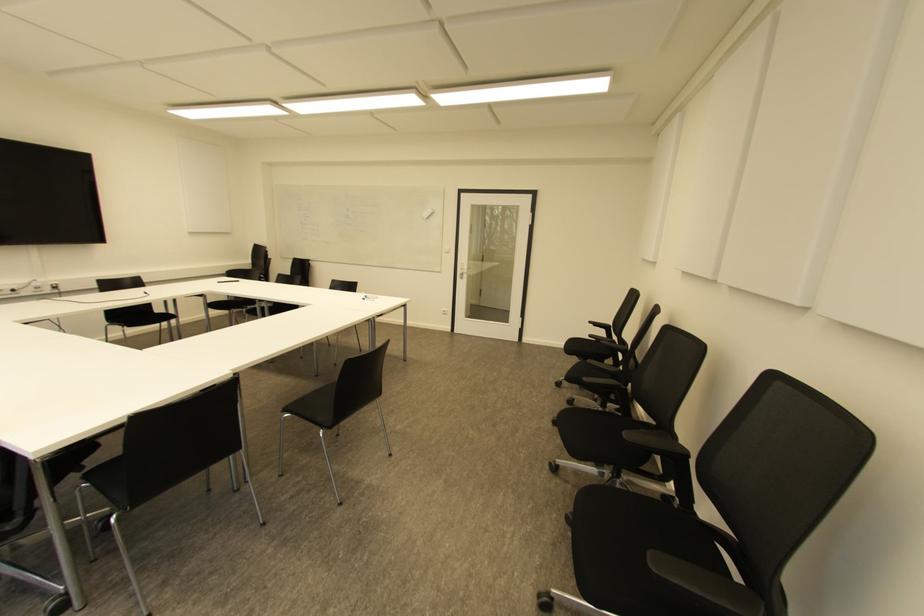
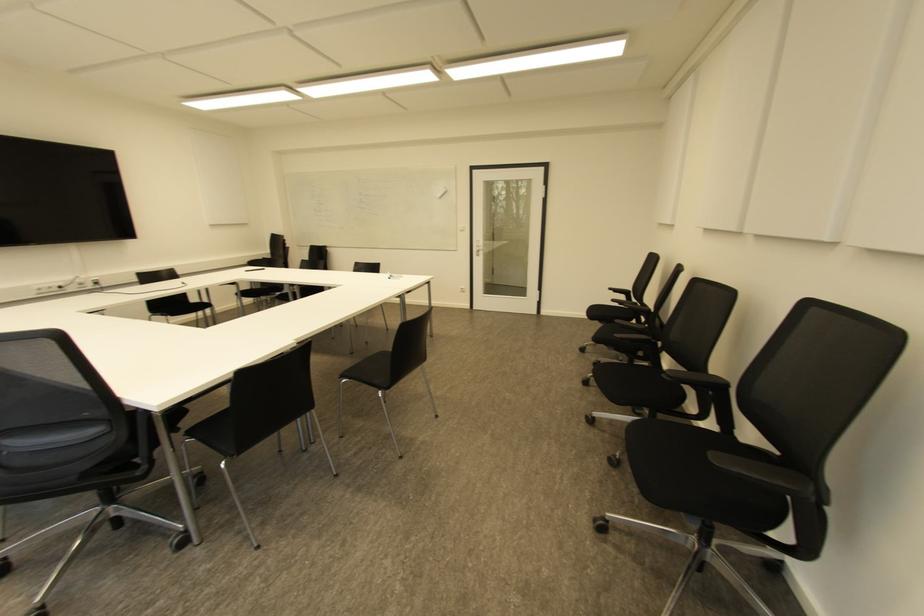
Question: The images are taken continuously from a first-person perspective. In which direction is your viewpoint rotating?

Choices:
 (A) Left
 (B) Right
 (C) Up
 (D) Down

Answer: (D)